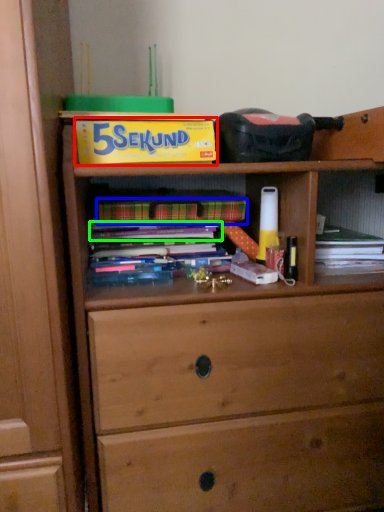
Question: Considering the real-world distances, which object is farthest from paperback book (highlighted by a red box)? paperback book (highlighted by a blue box) or book (highlighted by a green box)?

Choices:
 (A) paperback book
 (B) book

Answer: (B)